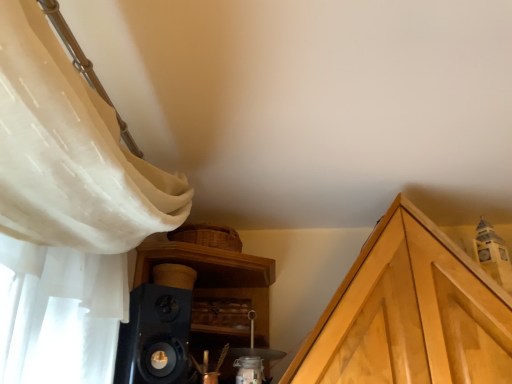
This screenshot has height=384, width=512. What are the coordinates of `light wood cabinetry at upper right` in the screenshot? It's located at (410, 314).

The width and height of the screenshot is (512, 384). Describe the element at coordinates (410, 314) in the screenshot. I see `light wood cabinetry at upper right` at that location.

What do you see at coordinates (155, 337) in the screenshot? I see `black matte speaker at lower left` at bounding box center [155, 337].

Identify the location of black matte speaker at lower left. (155, 337).

I want to click on light wood cabinetry at upper right, so click(x=410, y=314).

Which is more to the left, light wood cabinetry at upper right or black matte speaker at lower left?

Positioned to the left is black matte speaker at lower left.

Is light wood cabinetry at upper right further to the viewer compared to black matte speaker at lower left?

Yes, it is behind black matte speaker at lower left.

Considering the positions of points (446, 345) and (175, 375), is point (446, 345) farther from camera compared to point (175, 375)?

Yes.

From the image's perspective, is light wood cabinetry at upper right below black matte speaker at lower left?

Yes, from the image's perspective, light wood cabinetry at upper right is beneath black matte speaker at lower left.

In the scene shown: From a real-world perspective, which object rests below the other?

black matte speaker at lower left is physically lower.

Considering the relative sizes of light wood cabinetry at upper right and black matte speaker at lower left in the image provided, is light wood cabinetry at upper right thinner than black matte speaker at lower left?

No.

Is light wood cabinetry at upper right taller than black matte speaker at lower left?

Correct, light wood cabinetry at upper right is much taller as black matte speaker at lower left.

Considering the sizes of light wood cabinetry at upper right and black matte speaker at lower left in the image, is light wood cabinetry at upper right bigger or smaller than black matte speaker at lower left?

In the image, light wood cabinetry at upper right appears to be larger than black matte speaker at lower left.

Does light wood cabinetry at upper right contain black matte speaker at lower left?

No, black matte speaker at lower left is located outside of light wood cabinetry at upper right.

Is there a large distance between light wood cabinetry at upper right and black matte speaker at lower left?

Actually, light wood cabinetry at upper right and black matte speaker at lower left are a little close together.

Is light wood cabinetry at upper right turned away from black matte speaker at lower left?

No, light wood cabinetry at upper right is not facing the opposite direction of black matte speaker at lower left.

Can you tell me how much light wood cabinetry at upper right and black matte speaker at lower left differ in facing direction?

They differ by 42.1 degrees in their facing directions.

Where is `speaker that is above the light wood cabinetry at upper right (from the image's perspective)`? Image resolution: width=512 pixels, height=384 pixels. speaker that is above the light wood cabinetry at upper right (from the image's perspective) is located at coordinates click(155, 337).

Considering the relative positions of black matte speaker at lower left and light wood cabinetry at upper right in the image provided, is black matte speaker at lower left to the left or to the right of light wood cabinetry at upper right?

Based on their positions, black matte speaker at lower left is located to the left of light wood cabinetry at upper right.

Does black matte speaker at lower left lie in front of light wood cabinetry at upper right?

Yes, black matte speaker at lower left is closer to the camera.

Is point (159, 359) closer or farther from the camera than point (390, 207)?

Point (159, 359) is positioned closer to the camera compared to point (390, 207).

From the image's perspective, is black matte speaker at lower left above light wood cabinetry at upper right?

Correct, black matte speaker at lower left appears higher than light wood cabinetry at upper right in the image.

From a real-world perspective, who is located higher, black matte speaker at lower left or light wood cabinetry at upper right?

light wood cabinetry at upper right, from a real-world perspective.

Does black matte speaker at lower left have a lesser width compared to light wood cabinetry at upper right?

Yes.

Between black matte speaker at lower left and light wood cabinetry at upper right, which one has less height?

black matte speaker at lower left is shorter.

Considering the sizes of objects black matte speaker at lower left and light wood cabinetry at upper right in the image provided, who is smaller, black matte speaker at lower left or light wood cabinetry at upper right?

black matte speaker at lower left.

Consider the image. Is light wood cabinetry at upper right completely or partially inside black matte speaker at lower left?

No.

Is black matte speaker at lower left directly adjacent to light wood cabinetry at upper right?

No, black matte speaker at lower left is not touching light wood cabinetry at upper right.

In the scene shown: Is black matte speaker at lower left aimed at light wood cabinetry at upper right?

No, black matte speaker at lower left is not aimed at light wood cabinetry at upper right.

How many degrees apart are the facing directions of black matte speaker at lower left and light wood cabinetry at upper right?

black matte speaker at lower left and light wood cabinetry at upper right are facing 42.1 degrees away from each other.

How far apart are black matte speaker at lower left and light wood cabinetry at upper right?

A distance of 21.80 inches exists between black matte speaker at lower left and light wood cabinetry at upper right.

Where is `cabinetry above the black matte speaker at lower left (from a real-world perspective)`? cabinetry above the black matte speaker at lower left (from a real-world perspective) is located at coordinates (410, 314).

You are a GUI agent. You are given a task and a screenshot of the screen. Output one action in this format:
    pyautogui.click(x=<x>, y=<y>)
    Task: Click on the speaker below the light wood cabinetry at upper right (from a real-world perspective)
    The image size is (512, 384).
    Given the screenshot: What is the action you would take?
    pyautogui.click(x=155, y=337)

Find the location of a particular element. cabinetry that appears behind the black matte speaker at lower left is located at coordinates (410, 314).